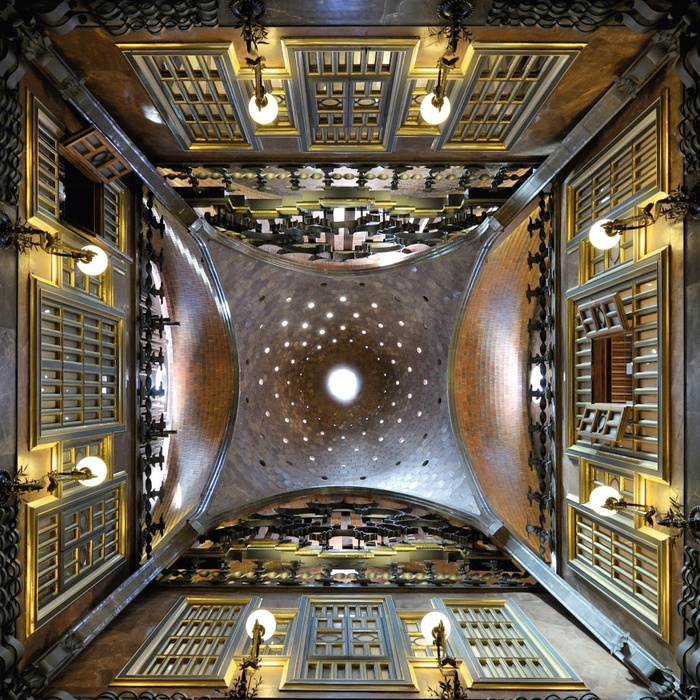
The width and height of the screenshot is (700, 700). What are the coordinates of `lights` in the screenshot? It's located at (344, 383), (94, 470), (267, 621), (444, 623), (603, 500), (596, 232), (435, 115), (271, 108), (94, 248).